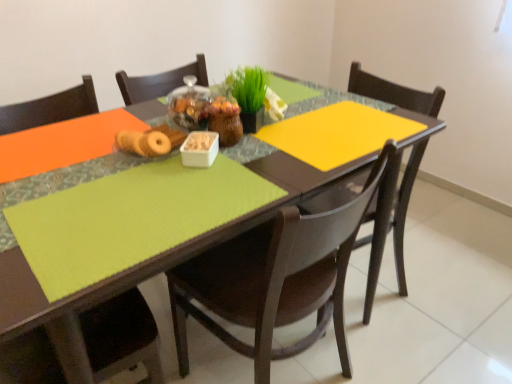
Where is `vacant area that is in front of white plastic container at center`? This screenshot has height=384, width=512. vacant area that is in front of white plastic container at center is located at coordinates (192, 195).